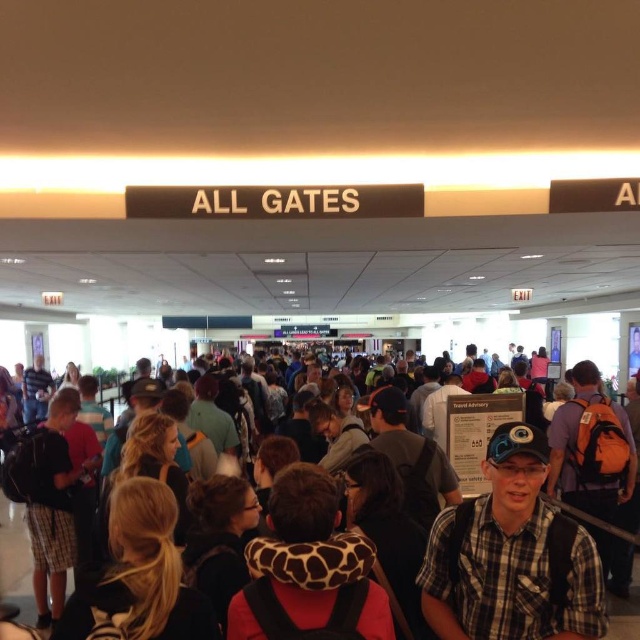
Question: In this image, where is giraffe-patterned neck pillow at center located relative to multicolored backpacks at center?

Choices:
 (A) below
 (B) above

Answer: (B)

Question: Which point is closer to the camera?

Choices:
 (A) plaid fabric shirt at center
 (B) giraffe-patterned neck pillow at center

Answer: (B)

Question: Which object appears farthest from the camera in this image?

Choices:
 (A) multicolored backpacks at center
 (B) plaid shorts at left
 (C) giraffe-patterned neck pillow at center
 (D) plaid fabric shirt at center

Answer: (B)

Question: Which object is positioned farthest from the giraffe-patterned neck pillow at center?

Choices:
 (A) plaid fabric shirt at center
 (B) multicolored backpacks at center

Answer: (B)

Question: Does plaid fabric shirt at center appear on the left side of plaid shorts at left?

Choices:
 (A) no
 (B) yes

Answer: (A)

Question: Can you confirm if plaid fabric shirt at center is smaller than giraffe-patterned neck pillow at center?

Choices:
 (A) yes
 (B) no

Answer: (B)